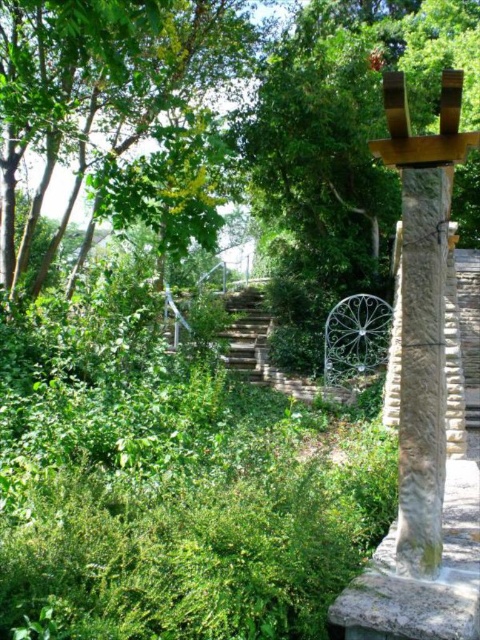
Is green leafy tree at center taller than gray stone pillar at right?

Correct, green leafy tree at center is much taller as gray stone pillar at right.

Based on the photo, can you confirm if green leafy tree at center is positioned below gray stone pillar at right?

Incorrect, green leafy tree at center is not positioned below gray stone pillar at right.

Locate an element on the screen. The image size is (480, 640). green leafy tree at center is located at coordinates (342, 147).

Between point (325, 237) and point (468, 268), which one is positioned behind?

The point (325, 237) is more distant.

Is green leafy tree at center to the left of smooth concrete stairs at center from the viewer's perspective?

Correct, you'll find green leafy tree at center to the left of smooth concrete stairs at center.

Who is more distant from viewer, (307, 77) or (472, 248)?

The point (472, 248) is more distant.

At what (x,y) coordinates should I click in order to perform the action: click on green leafy tree at center. Please return your answer as a coordinate pair (x, y). Image resolution: width=480 pixels, height=640 pixels. Looking at the image, I should click on (342, 147).

Does gray stone pillar at right lie in front of smooth concrete stairs at center?

Yes, it is.

Describe the element at coordinates (421, 369) in the screenshot. The width and height of the screenshot is (480, 640). I see `gray stone pillar at right` at that location.

You are a GUI agent. You are given a task and a screenshot of the screen. Output one action in this format:
    pyautogui.click(x=<x>, y=<y>)
    Task: Click on the gray stone pillar at right
    
    Given the screenshot: What is the action you would take?
    pyautogui.click(x=421, y=369)